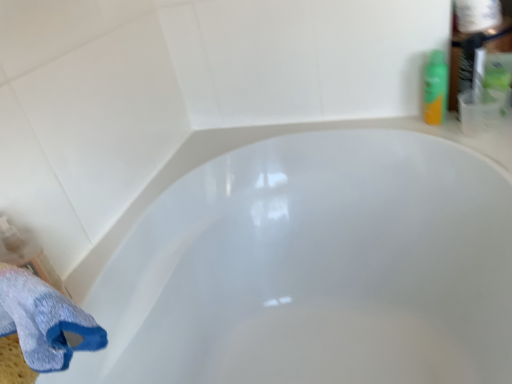
Question: Considering the positions of point (479, 3) and point (397, 276), is point (479, 3) closer or farther from the camera than point (397, 276)?

Choices:
 (A) farther
 (B) closer

Answer: (B)

Question: Considering their positions, is white paper towel at upper right located in front of or behind white glossy bathtub at center?

Choices:
 (A) behind
 (B) front

Answer: (A)

Question: Based on their relative distances, which object is nearer to the white glossy bathtub at center?

Choices:
 (A) blue textured bath towel at lower left
 (B) green plastic spray can at upper right
 (C) white paper towel at upper right

Answer: (B)

Question: Which of these objects is positioned farthest from the blue textured bath towel at lower left?

Choices:
 (A) white glossy bathtub at center
 (B) green plastic spray can at upper right
 (C) white paper towel at upper right

Answer: (C)